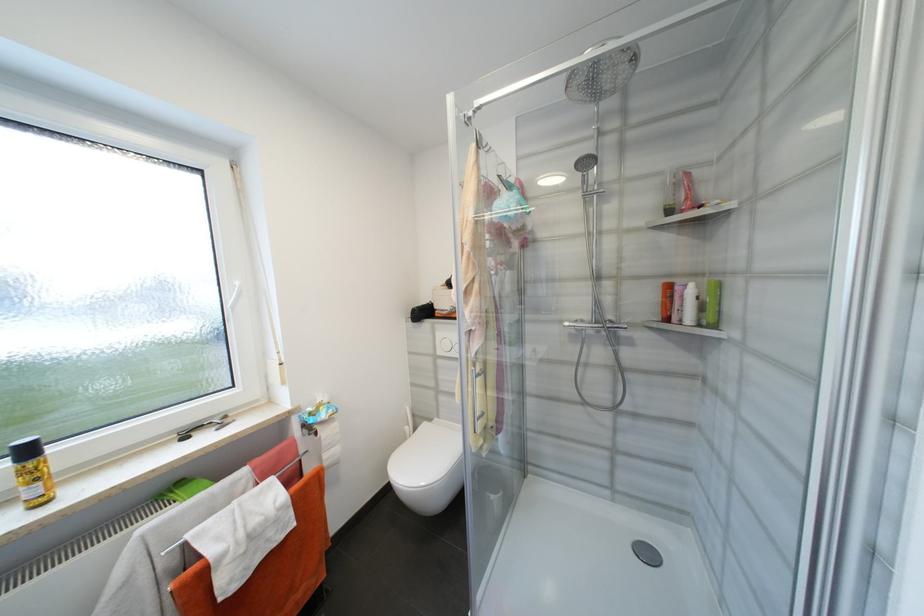
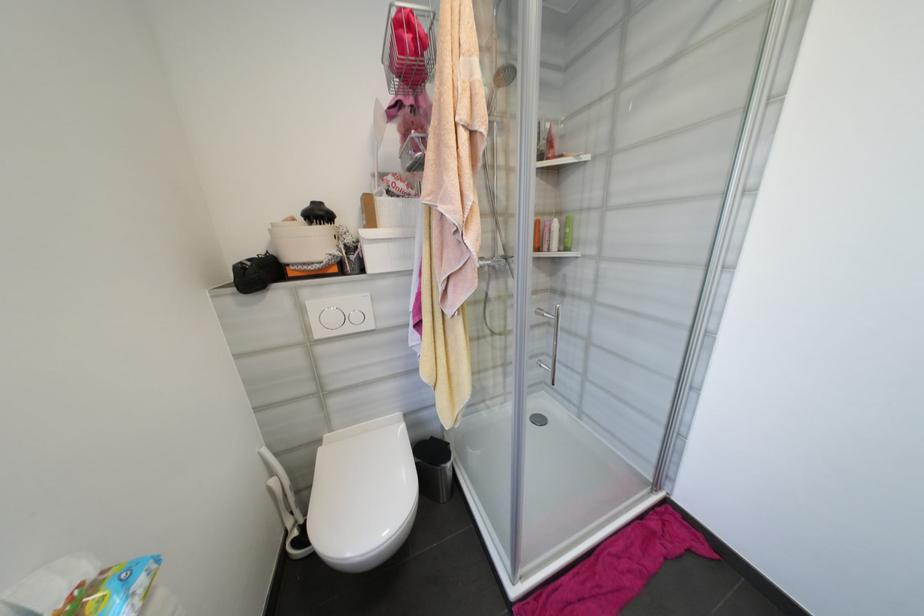
Question: The camera is either moving clockwise (left) or counter-clockwise (right) around the object. The first image is from the beginning of the video and the second image is from the end. Is the camera moving left or right when shooting the video?

Choices:
 (A) Left
 (B) Right

Answer: (A)